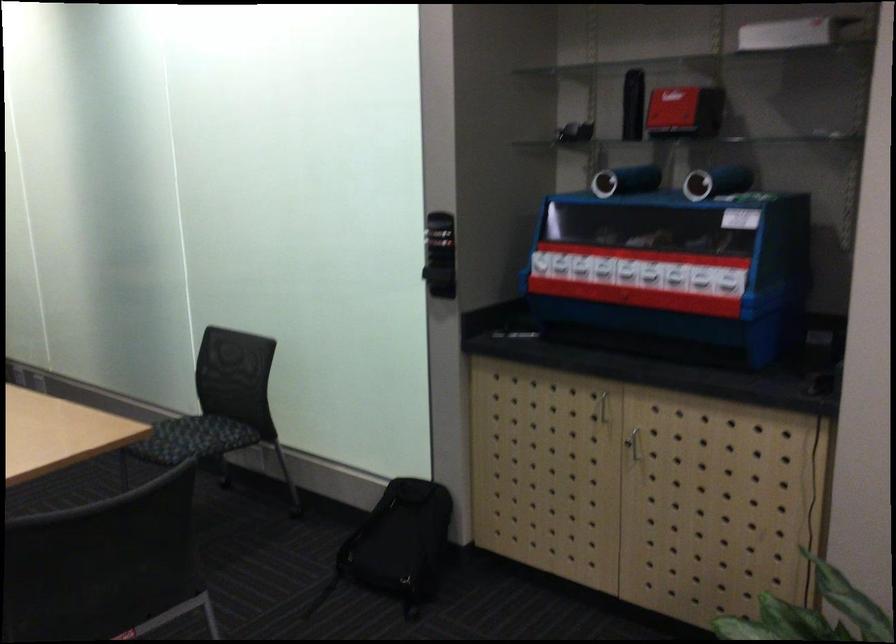
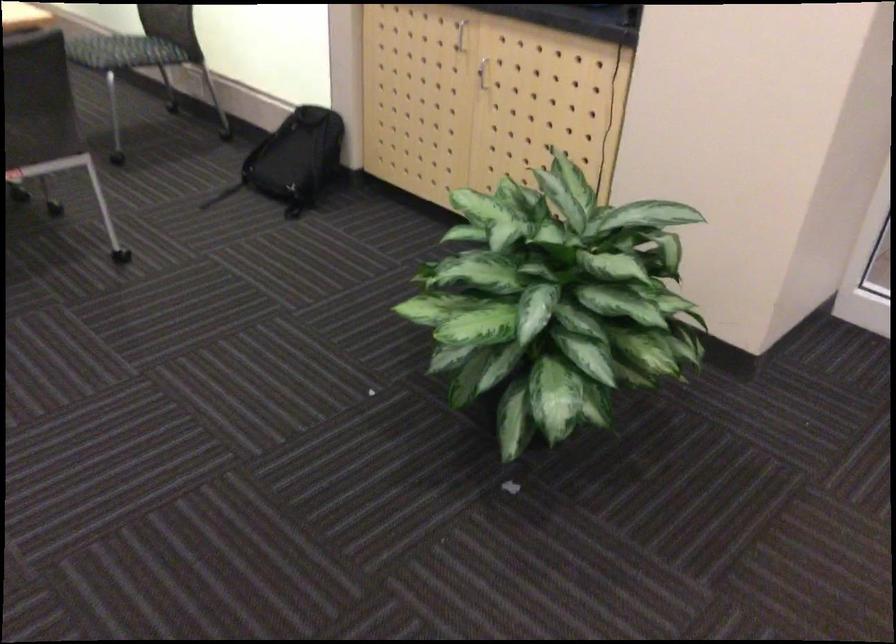
The point at [650,446] is marked in the first image. Where is the corresponding point in the second image?

(483, 73)